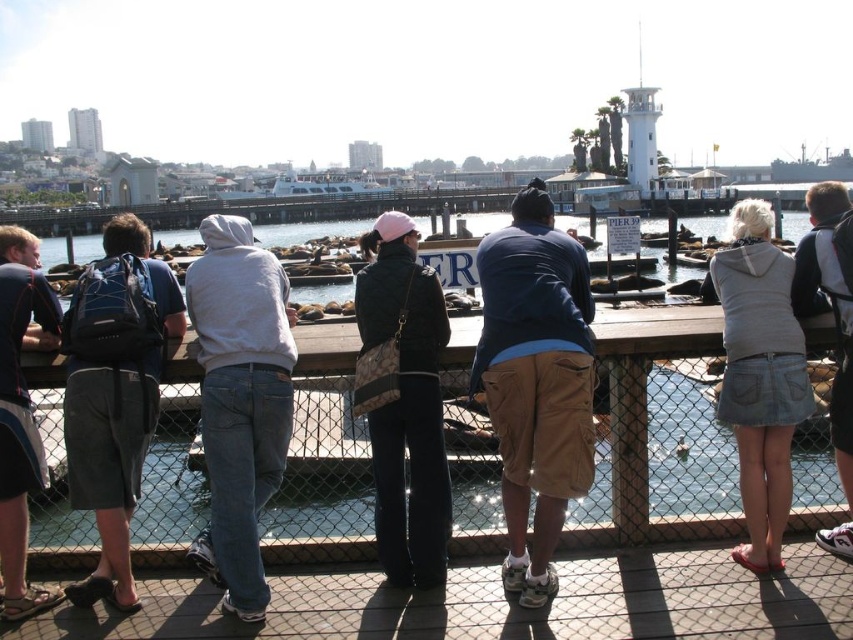
Does wooden dock at lower center lie in front of denim shorts at lower right?

Yes, wooden dock at lower center is closer to the viewer.

Can you confirm if wooden dock at lower center is thinner than denim shorts at lower right?

Incorrect, wooden dock at lower center's width is not less than denim shorts at lower right's.

Which is behind, point (708, 582) or point (838, 470)?

The point (838, 470) is more distant.

This screenshot has width=853, height=640. Find the location of `wooden dock at lower center`. wooden dock at lower center is located at coordinates (503, 604).

Who is shorter, denim skirt at lower right or dark gray shorts at left?

denim skirt at lower right

Between denim skirt at lower right and dark gray shorts at left, which one is positioned lower?

dark gray shorts at left

Describe the element at coordinates (759, 376) in the screenshot. The image size is (853, 640). I see `denim skirt at lower right` at that location.

Locate an element on the screen. The height and width of the screenshot is (640, 853). denim skirt at lower right is located at coordinates (759, 376).

Does point (488, 394) come behind point (218, 220)?

No.

Does blue cotton hoodie at center appear over light gray hoodie at center?

Actually, blue cotton hoodie at center is below light gray hoodie at center.

At what (x,y) coordinates should I click in order to perform the action: click on blue cotton hoodie at center. Please return your answer as a coordinate pair (x, y). Looking at the image, I should click on (537, 380).